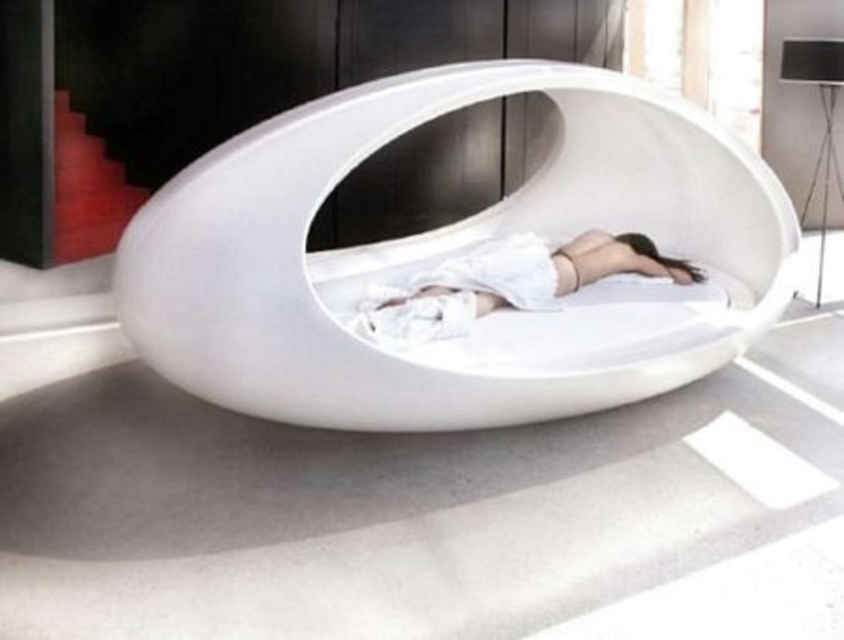
Is white glossy bed at center to the right of white matte fabric at center from the viewer's perspective?

No, white glossy bed at center is not to the right of white matte fabric at center.

Does white glossy bed at center appear under white matte fabric at center?

No.

Is point (317, 195) closer to viewer compared to point (464, 264)?

Yes, it is.

This screenshot has height=640, width=844. I want to click on white glossy bed at center, so click(x=448, y=252).